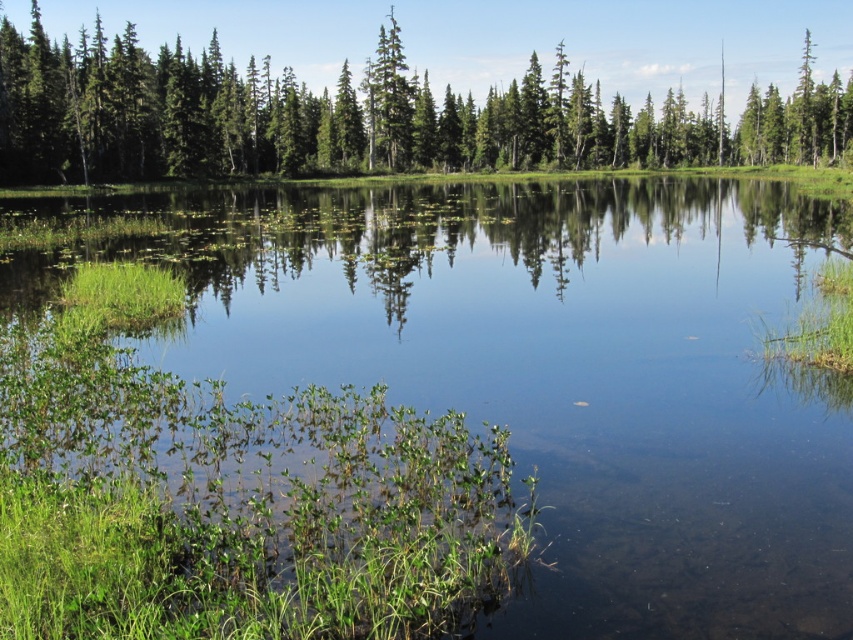
You are a kayaker planning to paddle from the clear water at center to the green glossy trees at upper center. Given that your kayak can only travel 80 meters before needing to rest, will you need to stop for a rest before reaching the trees?

The clear water at center and green glossy trees at upper center are 85.57 meters apart from each other. Since your kayak can only travel 80 meters before needing to rest, you will need to stop for a rest before reaching the green glossy trees at upper center.

You are standing on the grassy shore looking at the clear water at center and the green matte tree at center. Which object is closer to you?

The clear water at center is closer to you than the green matte tree at center.

You are standing at the edge of the water and want to take a photo of the green glossy trees at upper center. If your camera has a maximum zoom range of 100 meters, will you be able to capture the trees clearly?

The green glossy trees at upper center is 82.81 meters from viewer, so yes, the camera can zoom up to 100 meters, which is sufficient to capture the trees clearly.